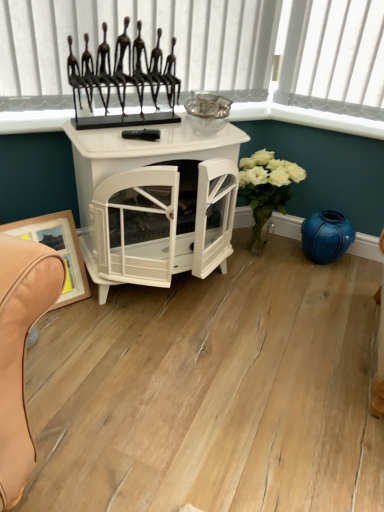
Locate an element on the screen. vacant area to the right of wooden framed picture at lower left is located at coordinates (102, 310).